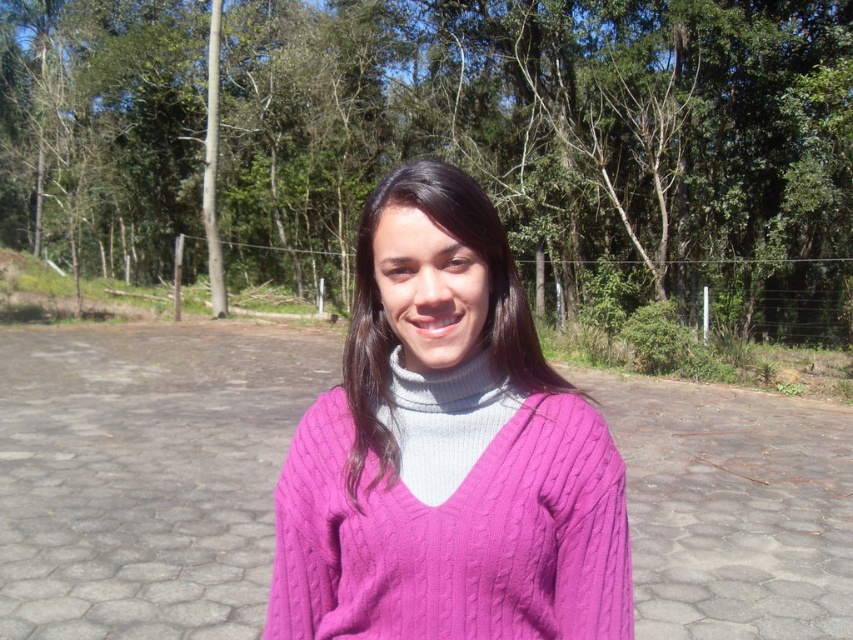
Question: Can you confirm if green leafy tree at center is smaller than cable-knit sweater at center?

Choices:
 (A) yes
 (B) no

Answer: (B)

Question: Is green leafy tree at center further to the viewer compared to cable-knit sweater at center?

Choices:
 (A) yes
 (B) no

Answer: (A)

Question: Which object appears farthest from the camera in this image?

Choices:
 (A) green leafy tree at center
 (B) cable-knit sweater at center

Answer: (A)

Question: Which object appears farthest from the camera in this image?

Choices:
 (A) green leafy tree at center
 (B) cable-knit sweater at center

Answer: (A)

Question: Which of the following is the farthest from the observer?

Choices:
 (A) (349, 35)
 (B) (612, 557)

Answer: (A)

Question: Is green leafy tree at center below cable-knit sweater at center?

Choices:
 (A) yes
 (B) no

Answer: (B)